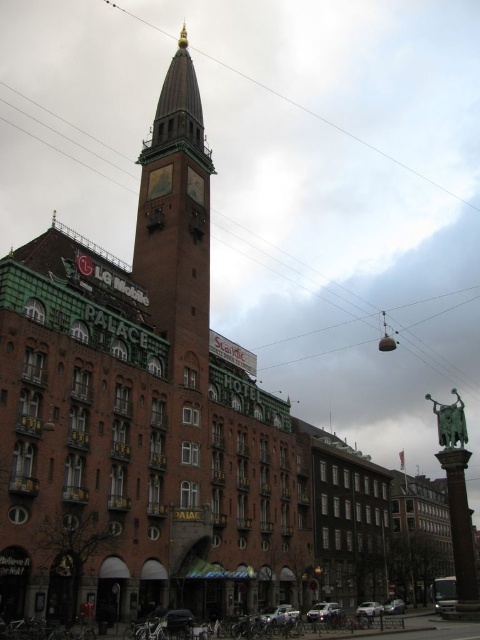
In the scene shown: Is brown wooden power line at upper center to the right of gold textured clock at upper center from the viewer's perspective?

Correct, you'll find brown wooden power line at upper center to the right of gold textured clock at upper center.

Is point (439, 188) less distant than point (168, 182)?

No, (439, 188) is behind (168, 182).

Does point (338, 128) lie in front of point (164, 172)?

No.

Find the location of `brown wooden power line at upper center`. brown wooden power line at upper center is located at coordinates (337, 129).

Is point (180, 368) closer to camera compared to point (167, 189)?

Yes, point (180, 368) is closer to viewer.

Where is `brick steeple at center`? The height and width of the screenshot is (640, 480). brick steeple at center is located at coordinates (177, 224).

Does brown wooden power line at upper center have a greater height compared to gold metallic clock at upper center?

Indeed, brown wooden power line at upper center has a greater height compared to gold metallic clock at upper center.

Between brown wooden power line at upper center and gold metallic clock at upper center, which one appears on the left side from the viewer's perspective?

From the viewer's perspective, gold metallic clock at upper center appears more on the left side.

Between point (136, 13) and point (195, 180), which one is positioned in front?

Point (195, 180) is more forward.

This screenshot has width=480, height=640. I want to click on brown wooden power line at upper center, so click(x=337, y=129).